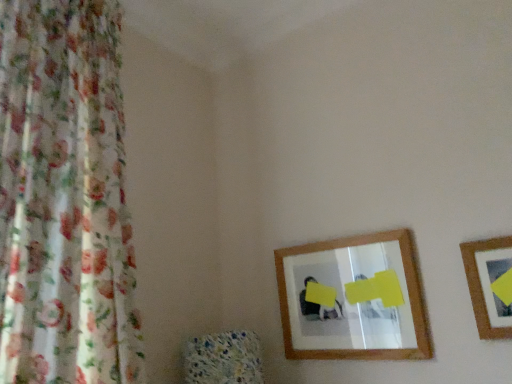
Question: From the image's perspective, relative to wooden picture frame at right, is floral fabric curtain at left above or below?

Choices:
 (A) above
 (B) below

Answer: (A)

Question: Is floral fabric curtain at left in front of or behind wooden picture frame at right in the image?

Choices:
 (A) behind
 (B) front

Answer: (B)

Question: Which of these objects is positioned farthest from the wooden picture frame at right?

Choices:
 (A) wooden-framed mirror at center
 (B) floral fabric curtain at left

Answer: (B)

Question: Estimate the real-world distances between objects in this image. Which object is closer to the wooden picture frame at right?

Choices:
 (A) floral fabric curtain at left
 (B) wooden-framed mirror at center

Answer: (B)